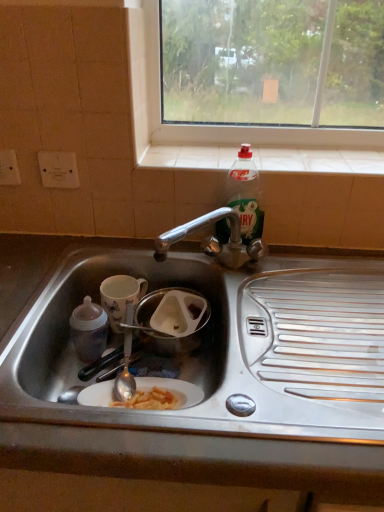
The width and height of the screenshot is (384, 512). In order to click on vacant space in front of translucent plastic bottle at upper right in this screenshot , I will do pyautogui.click(x=246, y=272).